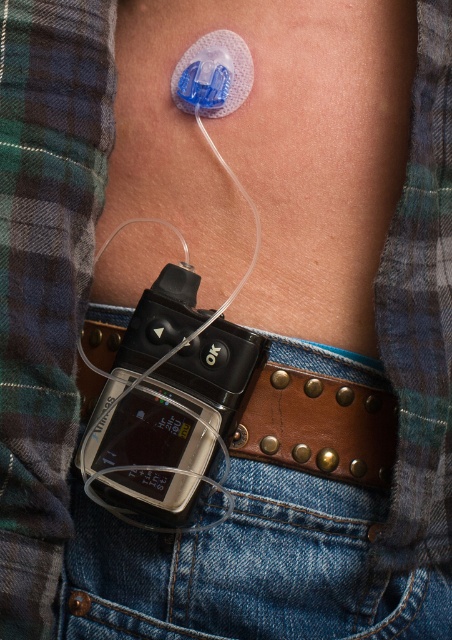
Can you confirm if denim at lower center is positioned above brown leather belt at lower center?

No, denim at lower center is not above brown leather belt at lower center.

Is point (271, 604) farther from viewer compared to point (325, 426)?

No, it is not.

The height and width of the screenshot is (640, 452). I want to click on denim at lower center, so click(x=249, y=570).